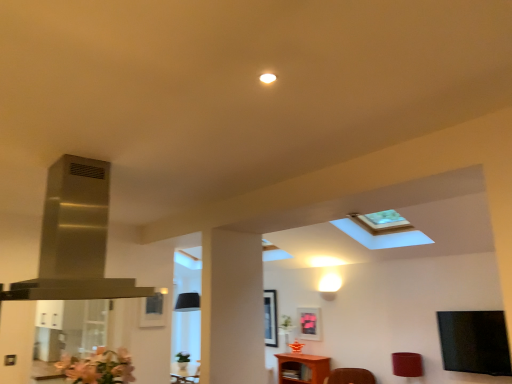
What are the coordinates of `brown wooden table at lower center` in the screenshot? It's located at (302, 368).

Describe the element at coordinates (270, 318) in the screenshot. I see `matte black picture frame at center, which is counted as the second picture frame, starting from the right` at that location.

Locate an element on the screen. This screenshot has height=384, width=512. transparent glass door at left is located at coordinates (67, 332).

Identify the location of matte black picture frame at center, acting as the 1th picture frame starting from the left. (153, 309).

What are the coordinates of `matte pink picture frame at center, the 2th picture frame from the front` in the screenshot? It's located at (309, 323).

Is matte black picture frame at center, which is counted as the 3th picture frame, starting from the back, far from brown wooden table at lower center?

Indeed, matte black picture frame at center, which is counted as the 3th picture frame, starting from the back, is not near brown wooden table at lower center.

From a real-world perspective, which is physically above, matte black picture frame at center, which is counted as the 3th picture frame, starting from the back, or brown wooden table at lower center?

matte black picture frame at center, which is counted as the 3th picture frame, starting from the back.

From the picture: From the image's perspective, is pink matte flower at lower left below matte pink picture frame at center, the 2th picture frame from the front?

No.

From a real-world perspective, which is physically below, pink matte flower at lower left or matte pink picture frame at center, the first picture frame viewed from the right?

From a 3D spatial view, pink matte flower at lower left is below.

Can you confirm if pink matte flower at lower left is thinner than matte pink picture frame at center, which is the second picture frame in back-to-front order?

No.

Does point (108, 369) come behind point (317, 332)?

That is False.

Find the location of a particular element. This screenshot has height=384, width=512. flower below the transparent glass door at left (from a real-world perspective) is located at coordinates (98, 367).

Is transparent glass door at left smaller than pink matte flower at lower left?

No.

Which object is closer to the camera taking this photo, transparent glass door at left or pink matte flower at lower left?

pink matte flower at lower left.

From the image's perspective, relative to pink matte flower at lower left, is transparent glass door at left above or below?

From the image's perspective, transparent glass door at left appears below pink matte flower at lower left.

Between transparent glass door at left and stainless steel exhaust hood at upper left, which one has larger width?

With larger width is stainless steel exhaust hood at upper left.

Is transparent glass door at left positioned in front of stainless steel exhaust hood at upper left?

No, the depth of transparent glass door at left is greater than that of stainless steel exhaust hood at upper left.

In the scene shown: From the image's perspective, would you say transparent glass door at left is shown under stainless steel exhaust hood at upper left?

Yes, from the image's perspective, transparent glass door at left is beneath stainless steel exhaust hood at upper left.

From the picture: Which is in front, stainless steel exhaust hood at upper left or pink matte flower at lower left?

Result: Positioned in front is stainless steel exhaust hood at upper left.

In terms of size, does stainless steel exhaust hood at upper left appear bigger or smaller than pink matte flower at lower left?

Considering their sizes, stainless steel exhaust hood at upper left takes up more space than pink matte flower at lower left.

Identify the location of flower behind the stainless steel exhaust hood at upper left. (98, 367).

Considering the relative sizes of stainless steel exhaust hood at upper left and pink matte flower at lower left in the image provided, is stainless steel exhaust hood at upper left taller than pink matte flower at lower left?

Yes.

From the image's perspective, between stainless steel exhaust hood at upper left and matte black picture frame at center, the first picture frame positioned from the back, which one is located above?

stainless steel exhaust hood at upper left appears higher in the image.

Which object is closer to the camera taking this photo, stainless steel exhaust hood at upper left or matte black picture frame at center, the first picture frame positioned from the back?

stainless steel exhaust hood at upper left is in front.

Which point is more forward, [114,291] or [268,344]?

The point [114,291] is in front.

In the scene shown: From a real-world perspective, is matte pink picture frame at center, the first picture frame viewed from the right, above or below matte black picture frame at center, the 3th picture frame viewed from the front?

From a real-world perspective, matte pink picture frame at center, the first picture frame viewed from the right, is physically below matte black picture frame at center, the 3th picture frame viewed from the front.

How many degrees apart are the facing directions of matte pink picture frame at center, which is the second picture frame in back-to-front order, and matte black picture frame at center, the first picture frame positioned from the back?

The angular difference between matte pink picture frame at center, which is the second picture frame in back-to-front order, and matte black picture frame at center, the first picture frame positioned from the back, is 0.00197 degrees.

From the image's perspective, does matte pink picture frame at center, the 2th picture frame from the front, appear higher than matte black picture frame at center, the 3th picture frame viewed from the front?

Yes, from the image's perspective, matte pink picture frame at center, the 2th picture frame from the front, is over matte black picture frame at center, the 3th picture frame viewed from the front.

Considering the sizes of matte pink picture frame at center, the first picture frame viewed from the right, and matte black picture frame at center, the first picture frame positioned from the back, in the image, is matte pink picture frame at center, the first picture frame viewed from the right, taller or shorter than matte black picture frame at center, the first picture frame positioned from the back,?

matte pink picture frame at center, the first picture frame viewed from the right, is shorter than matte black picture frame at center, the first picture frame positioned from the back.

The image size is (512, 384). Find the location of `table below the matte black picture frame at center, placed as the first picture frame when sorted from front to back (from the image's perspective)`. table below the matte black picture frame at center, placed as the first picture frame when sorted from front to back (from the image's perspective) is located at coordinates (302, 368).

Which picture frame is the 2nd one when counting from the back of the pink matte flower at lower left? Please provide its 2D coordinates.

[(309, 323)]

When comparing their distances from matte red lampshade at lower right, does matte black picture frame at center, the first picture frame positioned from the back, or matte black picture frame at center, placed as the first picture frame when sorted from front to back, seem closer?

matte black picture frame at center, the first picture frame positioned from the back.

From the image, which object appears to be nearer to stainless steel exhaust hood at upper left, matte red lampshade at lower right or pink matte flower at lower left?

pink matte flower at lower left.

Looking at this image, looking at the image, which one is located further to matte black picture frame at center, which is counted as the second picture frame, starting from the right, brown wooden table at lower center or matte red lampshade at lower right?

matte red lampshade at lower right is further to matte black picture frame at center, which is counted as the second picture frame, starting from the right.

From the image, which object appears to be farther from matte black picture frame at center, placed as the first picture frame when sorted from front to back, matte black picture frame at center, which ranks as the second picture frame in left-to-right order, or stainless steel exhaust hood at upper left?

Based on the image, stainless steel exhaust hood at upper left appears to be further to matte black picture frame at center, placed as the first picture frame when sorted from front to back.

Considering their positions, is matte black picture frame at center, the 3th picture frame viewed from the front, positioned further to pink matte flower at lower left than transparent glass door at left?

matte black picture frame at center, the 3th picture frame viewed from the front, lies further to pink matte flower at lower left than the other object.

From the image, which object appears to be nearer to matte black picture frame at center, which ranks as the second picture frame in left-to-right order, matte black picture frame at center, which is the third picture frame from right to left, or stainless steel exhaust hood at upper left?

The object closer to matte black picture frame at center, which ranks as the second picture frame in left-to-right order, is matte black picture frame at center, which is the third picture frame from right to left.

When comparing their distances from matte red lampshade at lower right, does brown wooden table at lower center or transparent glass door at left seem closer?

brown wooden table at lower center is closer to matte red lampshade at lower right.

Estimate the real-world distances between objects in this image. Which object is closer to matte red lampshade at lower right, matte pink picture frame at center, which is the second picture frame in back-to-front order, or transparent glass door at left?

matte pink picture frame at center, which is the second picture frame in back-to-front order, is positioned closer to the anchor matte red lampshade at lower right.

Identify the location of glass door positioned between pink matte flower at lower left and brown wooden table at lower center from near to far. The width and height of the screenshot is (512, 384). coord(67,332).

The image size is (512, 384). I want to click on glass door located between pink matte flower at lower left and matte pink picture frame at center, the first picture frame viewed from the right, in the depth direction, so click(x=67, y=332).

Find the location of a particular element. flower positioned between stainless steel exhaust hood at upper left and matte black picture frame at center, which is counted as the second picture frame, starting from the right, from near to far is located at coordinates (x=98, y=367).

Where is `picture frame between stainless steel exhaust hood at upper left and matte pink picture frame at center, the first picture frame viewed from the right, from front to back`? The image size is (512, 384). picture frame between stainless steel exhaust hood at upper left and matte pink picture frame at center, the first picture frame viewed from the right, from front to back is located at coordinates (153, 309).